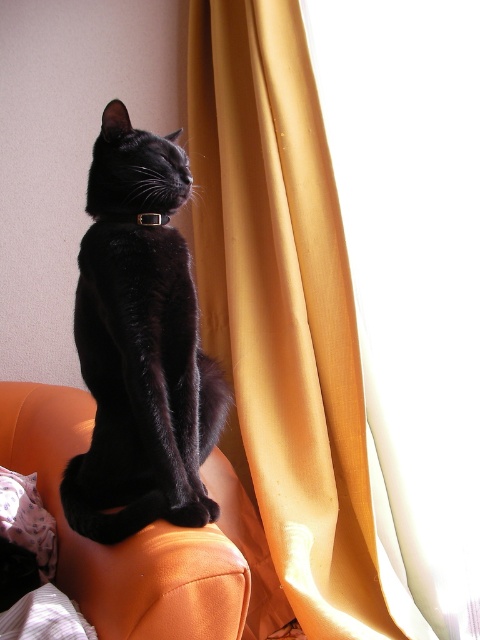
Question: Does matte black cat at center appear on the left side of orange leather couch at upper center?

Choices:
 (A) yes
 (B) no

Answer: (B)

Question: Which of the following is the closest to the observer?

Choices:
 (A) golden velvet curtain at right
 (B) matte black cat at center

Answer: (B)

Question: Is matte black cat at center bigger than orange leather couch at upper center?

Choices:
 (A) yes
 (B) no

Answer: (B)

Question: Which point is closer to the camera?

Choices:
 (A) matte black cat at center
 (B) golden velvet curtain at right

Answer: (A)

Question: Which point is closer to the camera?

Choices:
 (A) (195, 328)
 (B) (197, 582)
 (C) (278, 416)

Answer: (B)

Question: Does golden velvet curtain at right appear on the right side of matte black cat at center?

Choices:
 (A) no
 (B) yes

Answer: (B)